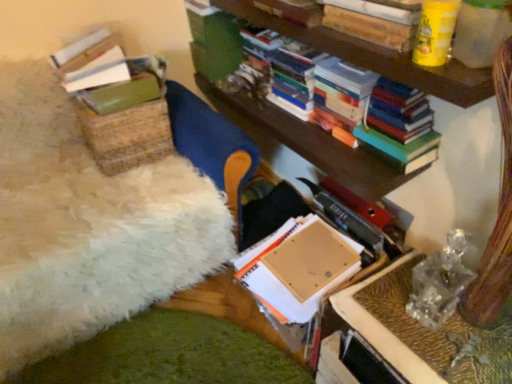
Question: Considering the relative sizes of hardcover books at upper right and cardboard box at center, arranged as the second book when viewed from the top, in the image provided, is hardcover books at upper right smaller than cardboard box at center, arranged as the second book when viewed from the top,?

Choices:
 (A) yes
 (B) no

Answer: (A)

Question: Is hardcover books at upper right to the right of cardboard box at center, arranged as the second book when viewed from the top, from the viewer's perspective?

Choices:
 (A) yes
 (B) no

Answer: (A)

Question: From a real-world perspective, is hardcover books at upper right under cardboard box at center, arranged as the second book when viewed from the top?

Choices:
 (A) no
 (B) yes

Answer: (A)

Question: Is hardcover books at upper right wider than cardboard box at center, arranged as the second book when viewed from the top?

Choices:
 (A) yes
 (B) no

Answer: (B)

Question: From the image's perspective, would you say hardcover books at upper right is shown under cardboard box at center, the 1th book from the bottom?

Choices:
 (A) yes
 (B) no

Answer: (B)

Question: In terms of height, does translucent plastic table at lower right look taller or shorter compared to hardcover books at upper right?

Choices:
 (A) short
 (B) tall

Answer: (A)

Question: In terms of width, does translucent plastic table at lower right look wider or thinner when compared to hardcover books at upper right?

Choices:
 (A) wide
 (B) thin

Answer: (A)

Question: Considering the positions of translucent plastic table at lower right and hardcover books at upper right in the image, is translucent plastic table at lower right bigger or smaller than hardcover books at upper right?

Choices:
 (A) small
 (B) big

Answer: (A)

Question: From the image's perspective, is translucent plastic table at lower right located above or below hardcover books at upper right?

Choices:
 (A) above
 (B) below

Answer: (B)

Question: Looking at the image, does cardboard box at center, arranged as the second book when viewed from the top, seem bigger or smaller compared to hardcover books at upper right?

Choices:
 (A) small
 (B) big

Answer: (B)

Question: From their relative heights in the image, would you say cardboard box at center, arranged as the second book when viewed from the top, is taller or shorter than hardcover books at upper right?

Choices:
 (A) tall
 (B) short

Answer: (A)

Question: Does point (275, 200) appear closer or farther from the camera than point (369, 132)?

Choices:
 (A) closer
 (B) farther

Answer: (B)

Question: Is cardboard box at center, arranged as the second book when viewed from the top, wider or thinner than hardcover books at upper right?

Choices:
 (A) wide
 (B) thin

Answer: (A)

Question: Does point (371, 241) appear closer or farther from the camera than point (414, 354)?

Choices:
 (A) closer
 (B) farther

Answer: (B)

Question: Is cardboard box at center, arranged as the second book when viewed from the top, in front of or behind translucent plastic table at lower right in the image?

Choices:
 (A) behind
 (B) front

Answer: (A)